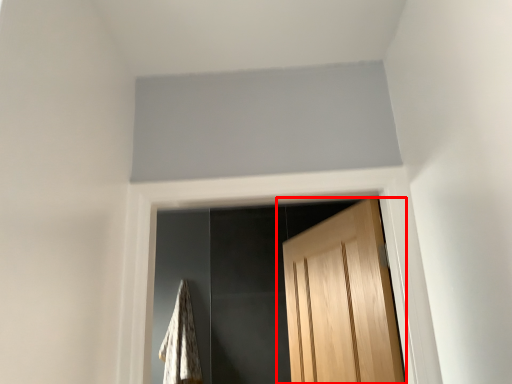
Question: From the image's perspective, considering the relative positions of door (annotated by the red box) and blanket in the image provided, where is door (annotated by the red box) located with respect to the staircase?

Choices:
 (A) above
 (B) below

Answer: (A)